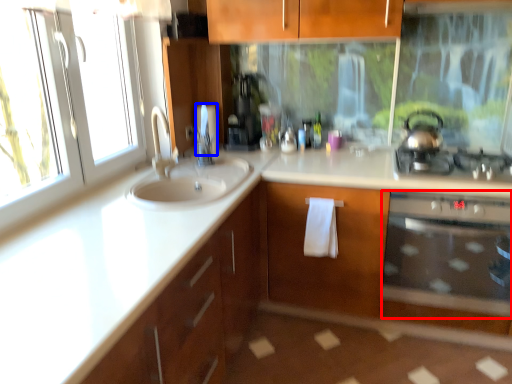
Question: Which point is further to the camera, oven (highlighted by a red box) or toilet paper (highlighted by a blue box)?

Choices:
 (A) oven
 (B) toilet paper

Answer: (B)